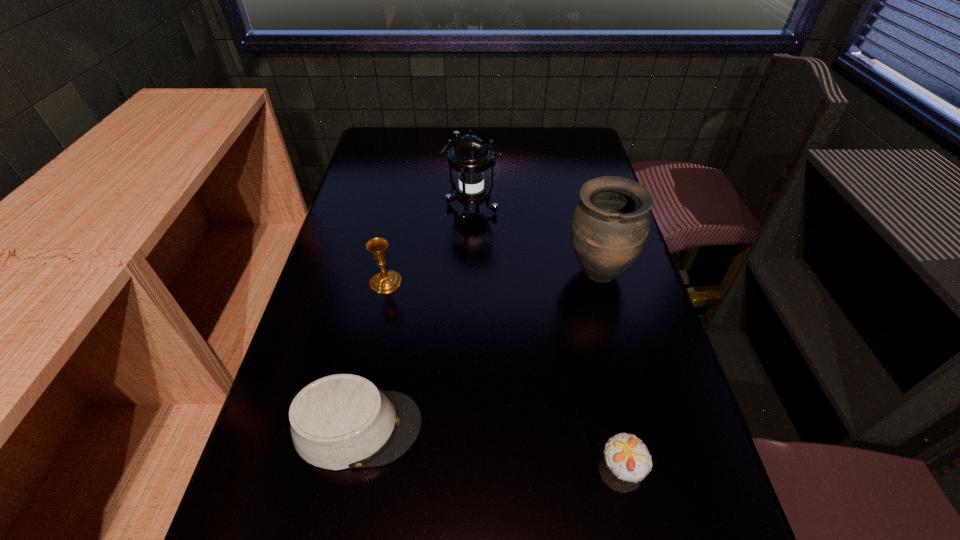
Where is `the farthest object`? the farthest object is located at coordinates pyautogui.click(x=470, y=157).

Where is `urn`? Image resolution: width=960 pixels, height=540 pixels. urn is located at coordinates (610, 225).

Locate an element on the screen. The height and width of the screenshot is (540, 960). the third tallest object is located at coordinates (384, 282).

The image size is (960, 540). Identify the location of hat. (342, 421).

The height and width of the screenshot is (540, 960). Identify the location of cupcake. (625, 462).

This screenshot has width=960, height=540. What are the coordinates of `free spot located 0.120m on the front of the lantern` in the screenshot? It's located at (470, 254).

Where is `vacant point located 0.340m on the left of the urn`? The image size is (960, 540). vacant point located 0.340m on the left of the urn is located at coordinates (433, 273).

Find the location of `blank area located on the front of the chalice`. blank area located on the front of the chalice is located at coordinates (368, 370).

This screenshot has width=960, height=540. Find the location of `free region located on the front-facing side of the hat`. free region located on the front-facing side of the hat is located at coordinates (505, 427).

Image resolution: width=960 pixels, height=540 pixels. Find the location of `free space located 0.200m on the back of the cupcake`. free space located 0.200m on the back of the cupcake is located at coordinates (596, 357).